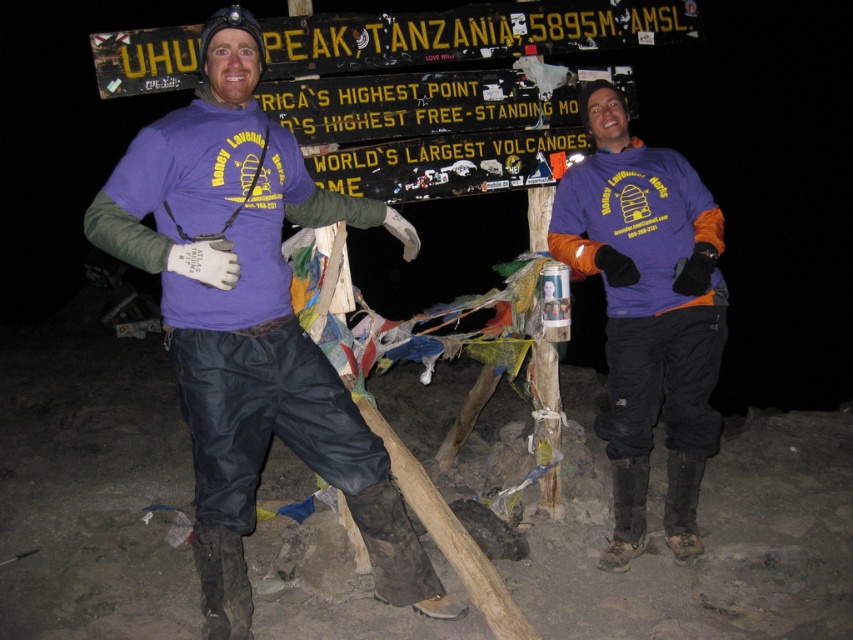
Can you confirm if purple fabric shirt at center is positioned below purple fabric shirt at right?

Yes.

Between purple fabric shirt at center and purple fabric shirt at right, which one has less height?

Standing shorter between the two is purple fabric shirt at center.

Identify the location of purple fabric shirt at center. The height and width of the screenshot is (640, 853). (251, 323).

Where is `purple fabric shirt at center`? Image resolution: width=853 pixels, height=640 pixels. purple fabric shirt at center is located at coordinates (251, 323).